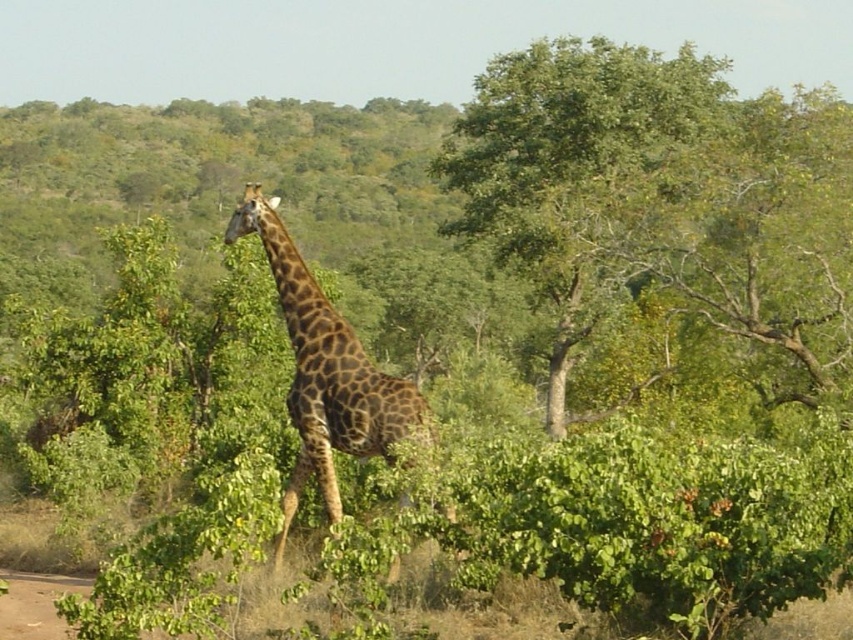
You are a photographer trying to capture the spotted fur giraffe at center. You notice a green leafy tree at upper right in the background. Which object is closer to you, the photographer?

The green leafy tree at upper right is closer to you than the spotted fur giraffe at center because it is positioned further to the viewer.

You are a bird flying over the savanna and want to land on the green leafy tree at upper right. From your current position above the spotted fur giraffe at center, which direction should you fly to reach the tree?

The green leafy tree at upper right is to the right of the spotted fur giraffe at center, so you should fly to the right to reach the tree.